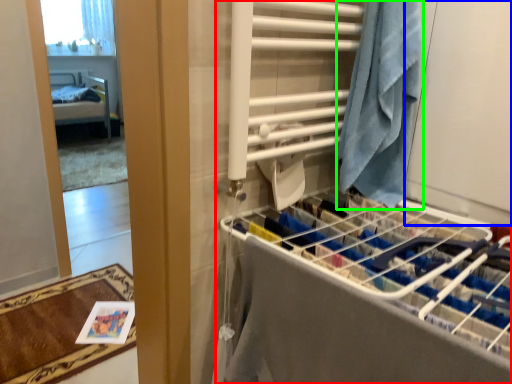
Question: Considering the real-world distances, which object is farthest from closet (highlighted by a red box)? screen door (highlighted by a blue box) or beach towel (highlighted by a green box)?

Choices:
 (A) screen door
 (B) beach towel

Answer: (A)